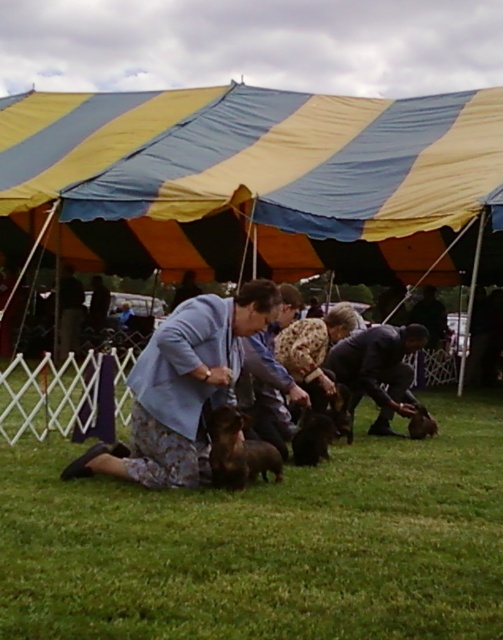
Can you confirm if green grass at center is positioned above brown furry dog at center?

No, green grass at center is not above brown furry dog at center.

Which is behind, point (25, 588) or point (412, 419)?

Point (412, 419)

I want to click on green grass at center, so click(266, 545).

Who is positioned more to the right, green grass at center or yellow striped tent at center?

Positioned to the right is green grass at center.

Is point (415, 541) in front of point (434, 278)?

Yes, it is in front of point (434, 278).

You are a GUI agent. You are given a task and a screenshot of the screen. Output one action in this format:
    pyautogui.click(x=<x>, y=<y>)
    Task: Click on the green grass at center
    This screenshot has width=503, height=640.
    Given the screenshot: What is the action you would take?
    pyautogui.click(x=266, y=545)

Who is shorter, yellow striped tent at center or dark blue shirt at center?

dark blue shirt at center

Consider the image. Which of these two, yellow striped tent at center or dark blue shirt at center, stands taller?

With more height is yellow striped tent at center.

Is point (131, 120) positioned after point (386, 433)?

That is True.

Where is `yellow striped tent at center`? yellow striped tent at center is located at coordinates (257, 182).